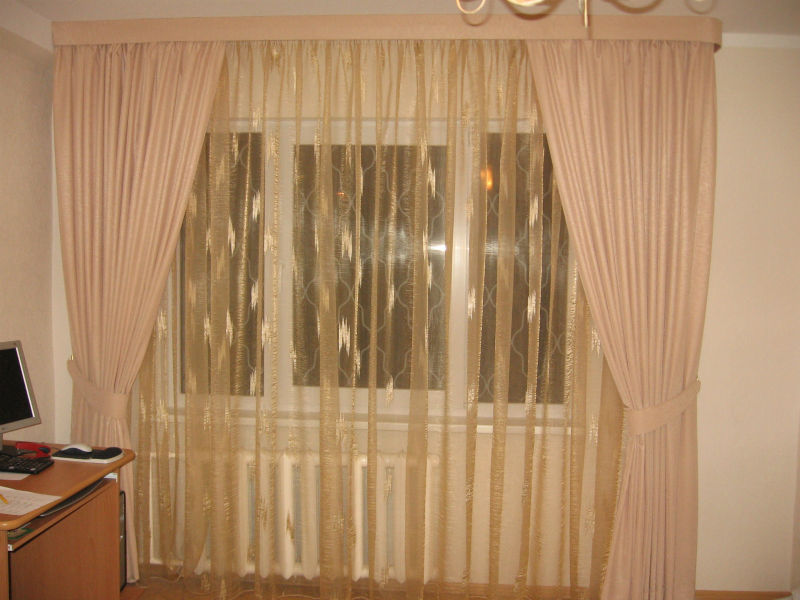
Locate an element on the screen. The image size is (800, 600). silver color monitor frame is located at coordinates (32, 399).